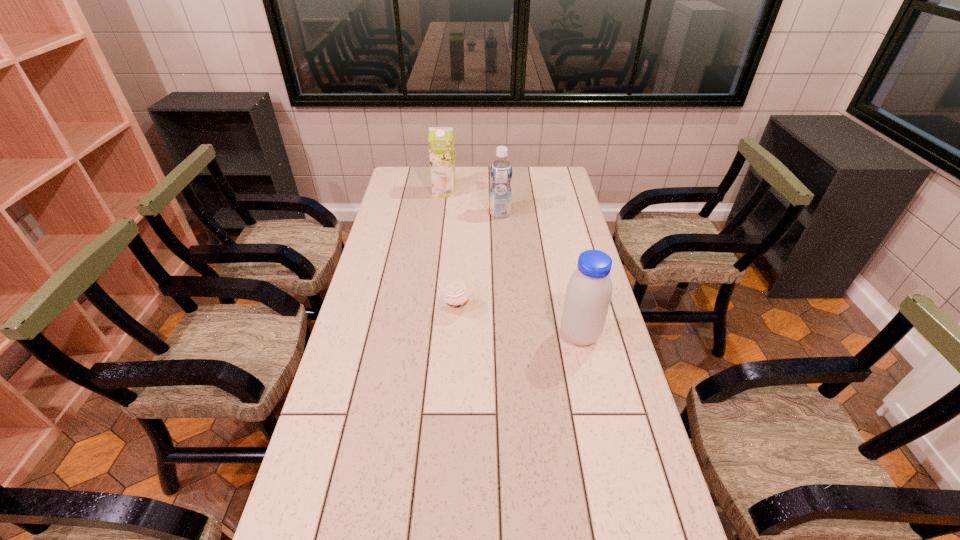
You are a GUI agent. You are given a task and a screenshot of the screen. Output one action in this format:
    pyautogui.click(x=<x>, y=<y>)
    Task: Click on the free region located 0.310m on the label of the second nearest soya milk
    Image resolution: width=960 pixels, height=540 pixels.
    Given the screenshot: What is the action you would take?
    pyautogui.click(x=416, y=213)

Image resolution: width=960 pixels, height=540 pixels. I want to click on blank space located on the label of the second nearest soya milk, so click(x=427, y=213).

The width and height of the screenshot is (960, 540). Find the location of `vacant point located 0.050m on the label of the second nearest soya milk`. vacant point located 0.050m on the label of the second nearest soya milk is located at coordinates (478, 213).

Find the location of a particular element. The image size is (960, 540). vacant space situated 0.370m on the right of the second nearest object is located at coordinates (586, 310).

Locate an element on the screen. object that is at the far edge is located at coordinates (441, 139).

You are a GUI agent. You are given a task and a screenshot of the screen. Output one action in this format:
    pyautogui.click(x=<x>, y=<y>)
    Task: Click on the object present at the right edge
    
    Given the screenshot: What is the action you would take?
    pyautogui.click(x=588, y=295)

Identify the location of vacant space at the far edge of the desktop. This screenshot has height=540, width=960. (468, 170).

Locate an element on the screen. vacant point at the left edge is located at coordinates (381, 253).

This screenshot has width=960, height=540. In the image, there is a desktop. Find the location of `vacant space at the right edge`. vacant space at the right edge is located at coordinates (569, 192).

What are the coordinates of `vacant space that is in between the farthest object and the second soya milk from left to right` in the screenshot? It's located at (472, 202).